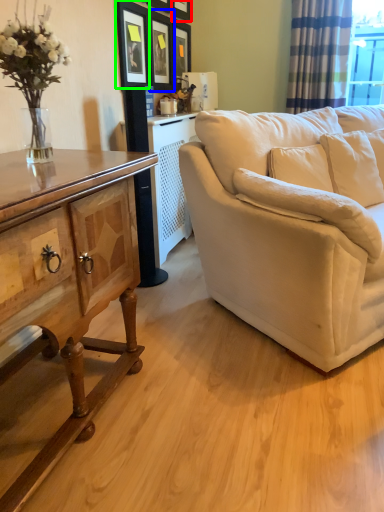
Question: Estimate the real-world distances between objects in this image. Which object is closer to picture frame (highlighted by a red box), picture frame (highlighted by a blue box) or picture frame (highlighted by a green box)?

Choices:
 (A) picture frame
 (B) picture frame

Answer: (A)